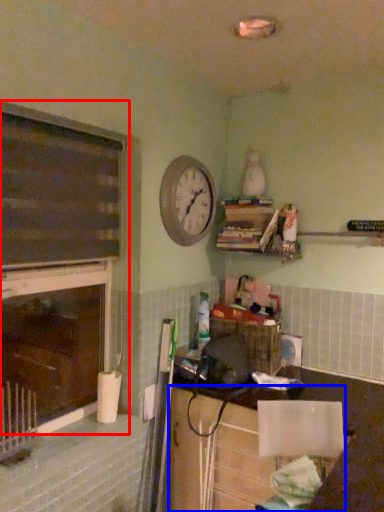
Question: Which point is further to the camera, window frame (highlighted by a red box) or cabinetry (highlighted by a blue box)?

Choices:
 (A) window frame
 (B) cabinetry

Answer: (B)